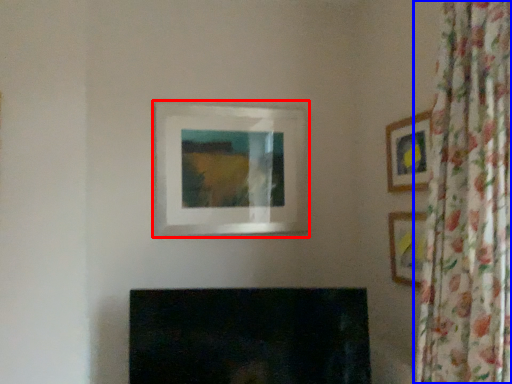
Question: Which object appears farthest to the camera in this image, picture frame (highlighted by a red box) or curtain (highlighted by a blue box)?

Choices:
 (A) picture frame
 (B) curtain

Answer: (A)